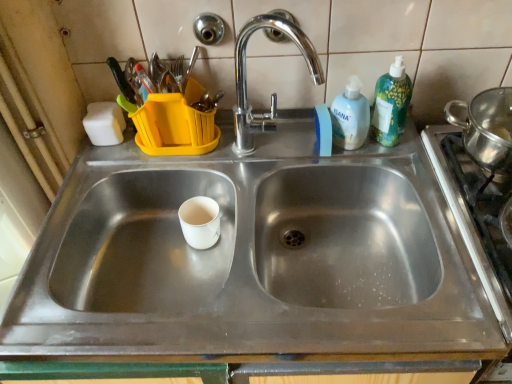
At what (x,y) coordinates should I click in order to perform the action: click on free point in front of white plastic bottle at upper right, the 1th cleaning product when ordered from left to right. Please return your answer as a coordinate pair (x, y). The height and width of the screenshot is (384, 512). Looking at the image, I should click on (387, 170).